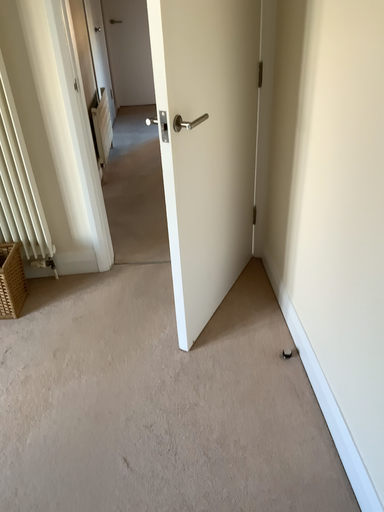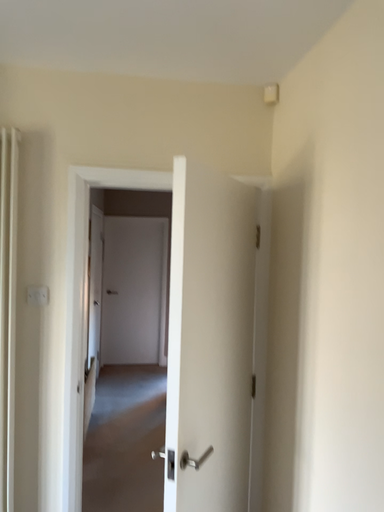
Question: Which way did the camera rotate in the video?

Choices:
 (A) rotated downward
 (B) rotated upward

Answer: (B)